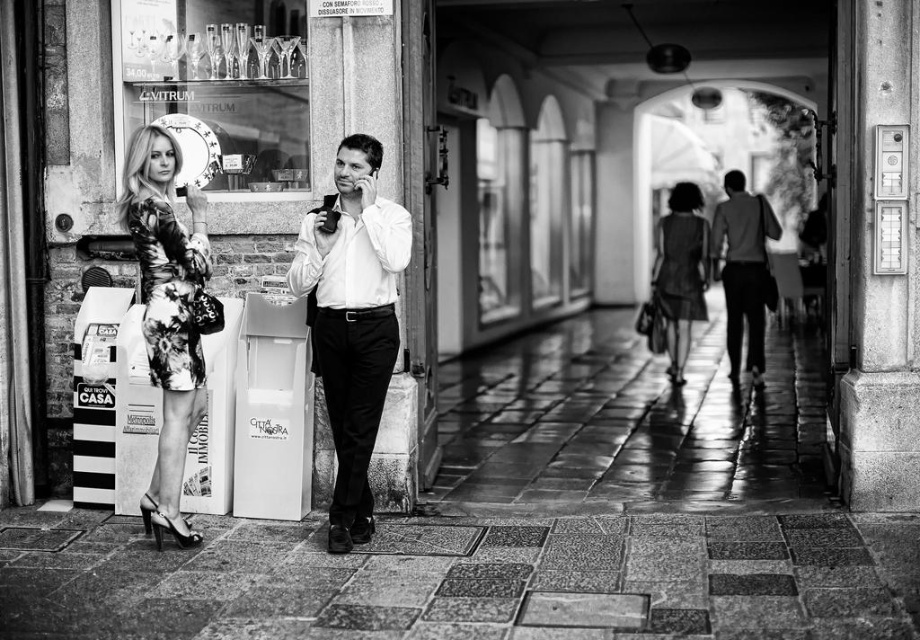
Based on the scene description, where is the smooth white shirt at center located in the image?

The smooth white shirt at center is located at point coordinates of (x=352, y=321).

You are a construction worker assessing the scene. You need to determine if the granite tiles at center can be placed on top of the dark gray suit at center without damaging it. Can you do this?

The granite tiles at center has a lesser height compared to dark gray suit at center, so placing the granite tiles at center on top of the dark gray suit at center would not damage it as the tiles are shorter in height.

You are a photographer trying to capture a candid shot of the two people at the center of the scene. Since you want to ensure both subjects are in focus, you need to know which one is narrower. Which of the two, the smooth white shirt at center or the dark gray suit at center, is narrower?

The smooth white shirt at center is narrower than the dark gray suit at center.